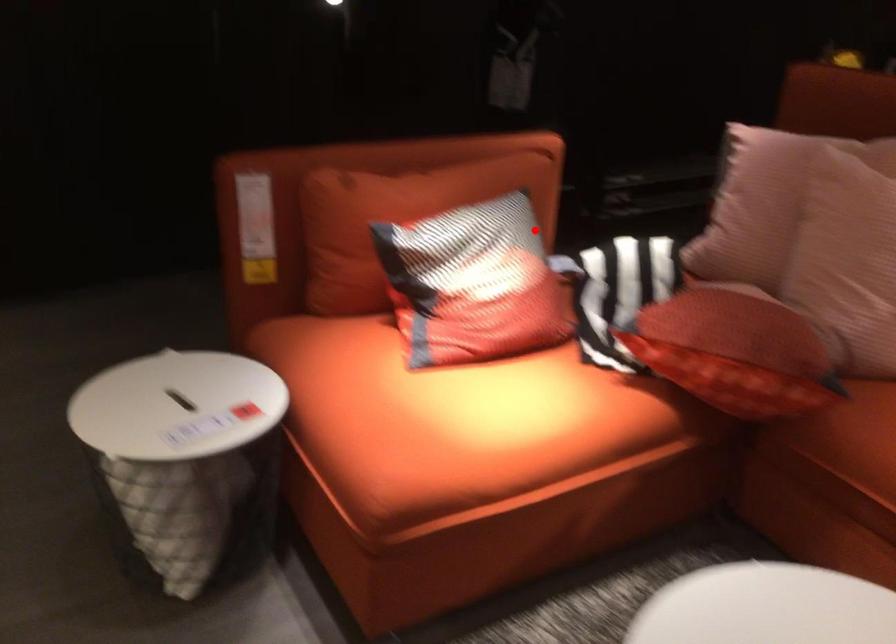
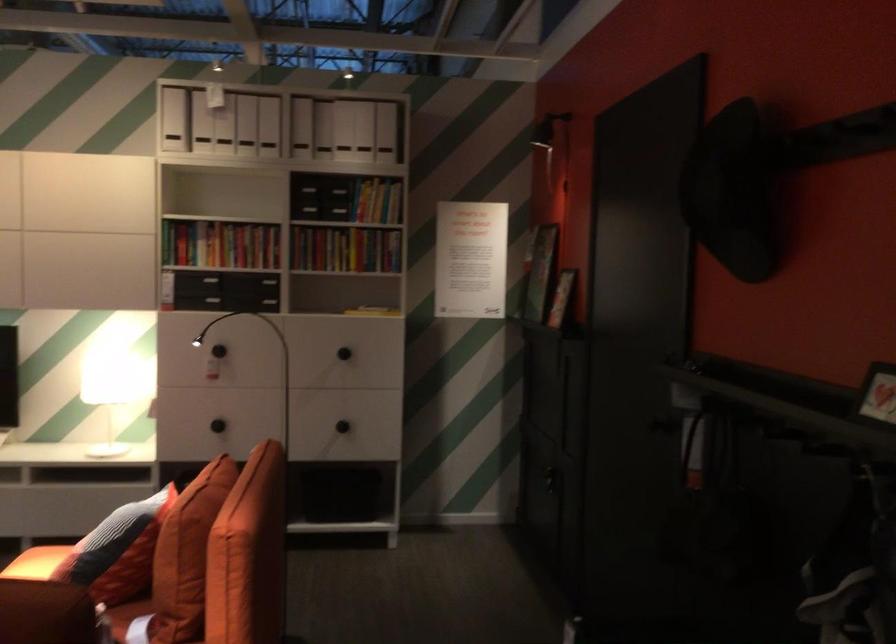
The point at the highlighted location is marked in the first image. Where is the corresponding point in the second image?

(117, 551)